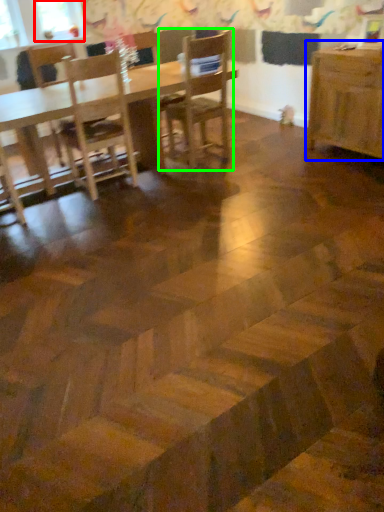
Question: Which object is positioned farthest from window screen (highlighted by a red box)? Select from table (highlighted by a blue box) and chair (highlighted by a green box).

Choices:
 (A) table
 (B) chair

Answer: (A)